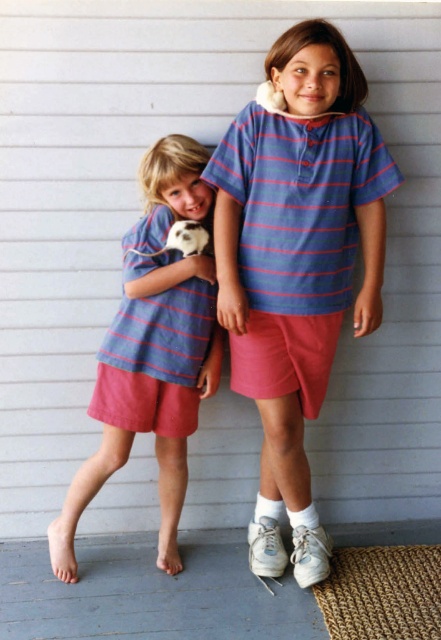
Question: Which point is closer to the camera?

Choices:
 (A) matte blue striped shirt at left
 (B) blue striped shirt at center

Answer: (B)

Question: Is blue striped shirt at center bigger than matte blue striped shirt at left?

Choices:
 (A) no
 (B) yes

Answer: (B)

Question: Can you confirm if blue striped shirt at center is positioned above matte blue striped shirt at left?

Choices:
 (A) yes
 (B) no

Answer: (A)

Question: Among these objects, which one is farthest from the camera?

Choices:
 (A) blue striped shirt at center
 (B) matte blue striped shirt at left

Answer: (B)

Question: Among these objects, which one is nearest to the camera?

Choices:
 (A) matte blue striped shirt at left
 (B) blue striped shirt at center

Answer: (B)

Question: Observing the image, what is the correct spatial positioning of blue striped shirt at center in reference to matte blue striped shirt at left?

Choices:
 (A) below
 (B) above

Answer: (B)